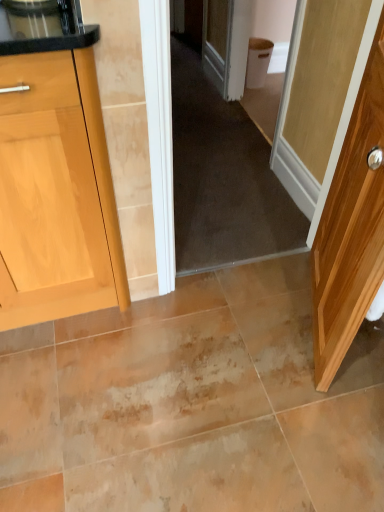
What do you see at coordinates (263, 142) in the screenshot?
I see `carpeted corridor at center` at bounding box center [263, 142].

This screenshot has height=512, width=384. I want to click on carpeted corridor at center, so click(x=263, y=142).

Image resolution: width=384 pixels, height=512 pixels. I want to click on carpeted corridor at center, so click(x=263, y=142).